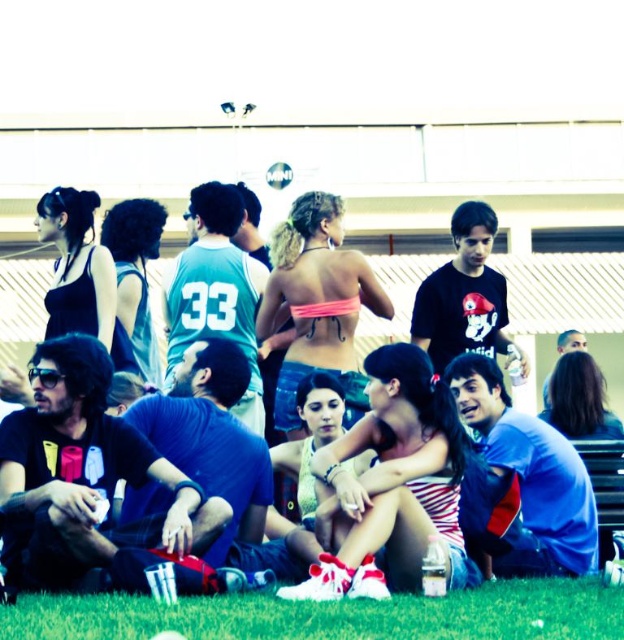
You are standing in the middle of the grassy area at the outdoor gathering. There are two points marked in the scene. Which point is closer to you, point (265,621) or point (22,381)?

Point (265,621) is closer to the viewer than point (22,381).

Consider the image. You are standing in the scene and want to sit down on the green grass at lower center. Which direction should you move relative to the matte blue shirt at center?

You should move to the right of the matte blue shirt at center to reach the green grass at lower center.

You are a photographer standing at the edge of the basketball court. You want to take a photo that includes both the green grass at lower center and the matte blue shirt at center. Given that your camera has a maximum focus range of 15 meters, will you be able to capture both objects in focus at the same time?

The green grass at lower center is 17.57 meters from the matte blue shirt at center. Since the distance between them exceeds the camera maximum focus range of 15 meters, you cannot capture both objects in focus simultaneously.